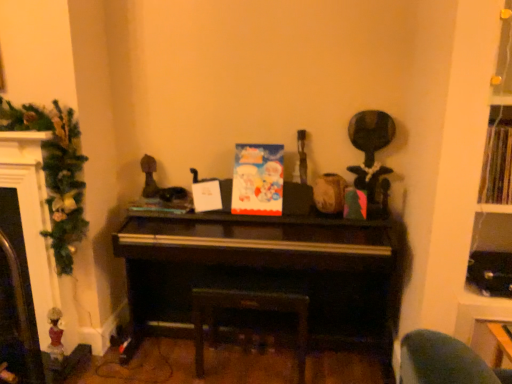
Question: Can matte plastic book at center, which is the 2th book from right to left, be found inside dark wood stool at center?

Choices:
 (A) no
 (B) yes

Answer: (A)

Question: Is dark wood stool at center smaller than matte plastic book at center, placed as the 1th book when sorted from left to right?

Choices:
 (A) yes
 (B) no

Answer: (B)

Question: From a real-world perspective, is dark wood stool at center physically below matte plastic book at center, which is counted as the 2th book, starting from the front?

Choices:
 (A) no
 (B) yes

Answer: (B)

Question: Does dark wood stool at center appear on the right side of matte plastic book at center, marked as the 1th book in a back-to-front arrangement?

Choices:
 (A) yes
 (B) no

Answer: (A)

Question: From a real-world perspective, is dark wood stool at center physically above matte plastic book at center, which is counted as the 2th book, starting from the front?

Choices:
 (A) no
 (B) yes

Answer: (A)

Question: Would you say green textured garland at left is to the left or to the right of matte paper card at center in the picture?

Choices:
 (A) right
 (B) left

Answer: (B)

Question: From the image's perspective, relative to matte paper card at center, is green textured garland at left above or below?

Choices:
 (A) below
 (B) above

Answer: (A)

Question: Is green textured garland at left inside the boundaries of matte paper card at center, or outside?

Choices:
 (A) outside
 (B) inside

Answer: (A)

Question: Considering the positions of green textured garland at left and matte paper card at center in the image, is green textured garland at left wider or thinner than matte paper card at center?

Choices:
 (A) wide
 (B) thin

Answer: (A)

Question: Looking at the image, does dark wood stool at center seem bigger or smaller compared to green textured garland at left?

Choices:
 (A) small
 (B) big

Answer: (B)

Question: Which is correct: dark wood stool at center is inside green textured garland at left, or outside of it?

Choices:
 (A) outside
 (B) inside

Answer: (A)

Question: In the image, is dark wood stool at center on the left side or the right side of green textured garland at left?

Choices:
 (A) left
 (B) right

Answer: (B)

Question: From a real-world perspective, is dark wood stool at center physically located above or below green textured garland at left?

Choices:
 (A) below
 (B) above

Answer: (A)

Question: Considering the positions of wooden book at upper right, the first book in the front-to-back sequence, and matte plastic book at center, placed as the 1th book when sorted from left to right, in the image, is wooden book at upper right, the first book in the front-to-back sequence, wider or thinner than matte plastic book at center, placed as the 1th book when sorted from left to right,?

Choices:
 (A) thin
 (B) wide

Answer: (A)

Question: Considering the positions of wooden book at upper right, acting as the second book starting from the left, and matte plastic book at center, which is counted as the 2th book, starting from the front, in the image, is wooden book at upper right, acting as the second book starting from the left, taller or shorter than matte plastic book at center, which is counted as the 2th book, starting from the front,?

Choices:
 (A) short
 (B) tall

Answer: (B)